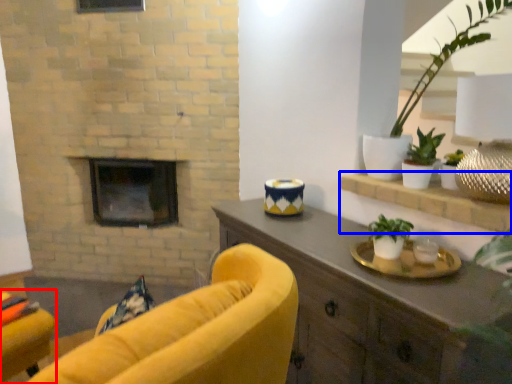
Question: Among these objects, which one is farthest to the camera, chair (highlighted by a red box) or shelf (highlighted by a blue box)?

Choices:
 (A) chair
 (B) shelf

Answer: (A)